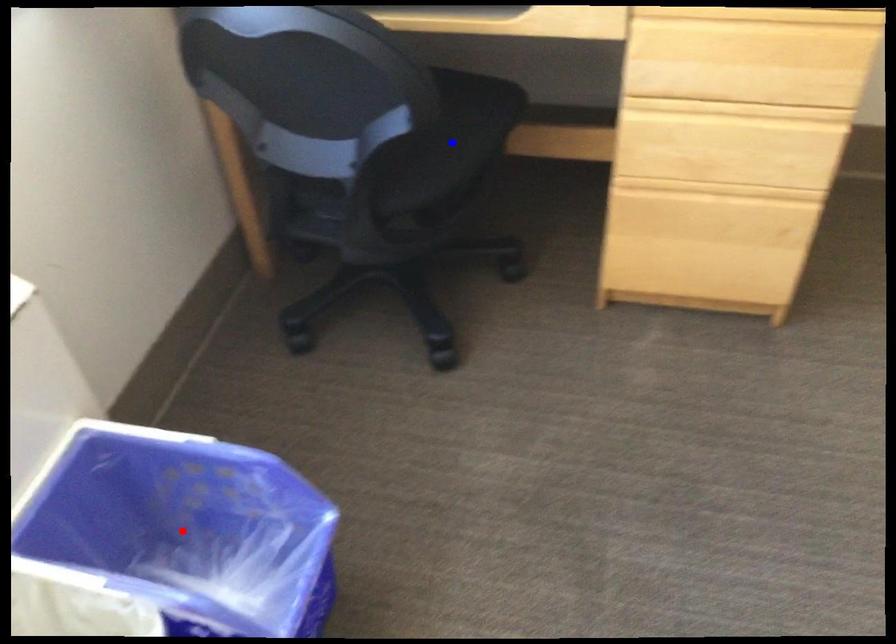
Question: In the image, two points are highlighted. Which point is nearer to the camera? Reply with the corresponding letter.

Choices:
 (A) blue point
 (B) red point

Answer: (B)